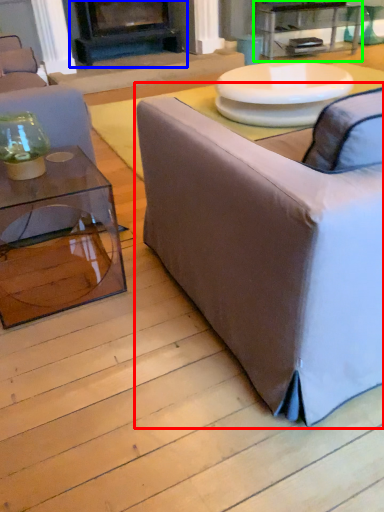
Question: Which object is the farthest from studio couch (highlighted by a red box)? Choose among these: fireplace (highlighted by a blue box) or table (highlighted by a green box).

Choices:
 (A) fireplace
 (B) table

Answer: (B)